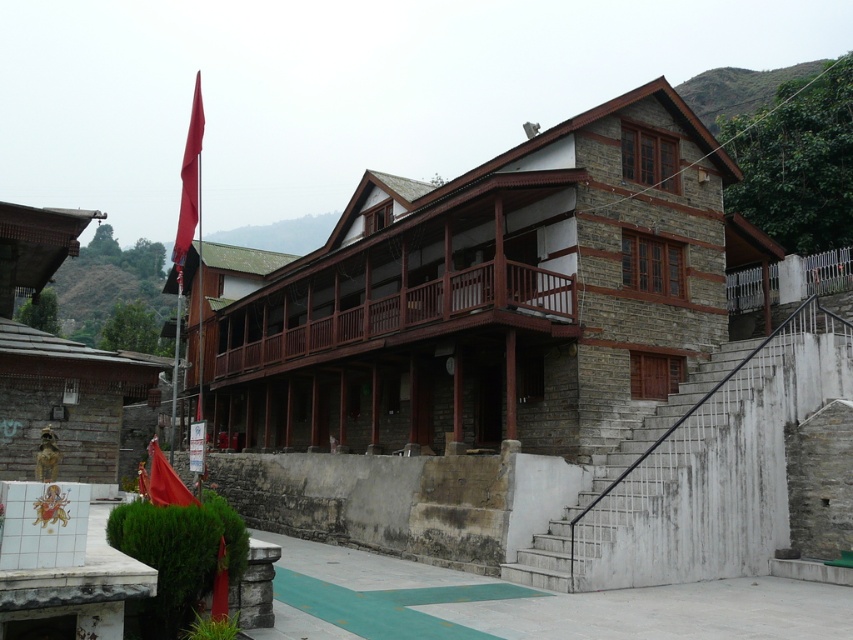
Question: Observing the image, what is the correct spatial positioning of white concrete stairs at center in reference to red fabric flag at upper left?

Choices:
 (A) left
 (B) right

Answer: (B)

Question: Which object is positioned closest to the red fabric flag at upper left?

Choices:
 (A) white concrete stairs at center
 (B) shiny red flag at lower left

Answer: (A)

Question: Does red fabric flag at upper left appear over shiny red flag at lower left?

Choices:
 (A) yes
 (B) no

Answer: (A)

Question: Which point appears closest to the camera in this image?

Choices:
 (A) (172, 500)
 (B) (647, 480)
 (C) (186, 152)

Answer: (A)

Question: Which of the following is the farthest from the observer?

Choices:
 (A) white concrete stairs at center
 (B) shiny red flag at lower left

Answer: (A)

Question: Does white concrete stairs at center have a smaller size compared to shiny red flag at lower left?

Choices:
 (A) no
 (B) yes

Answer: (B)